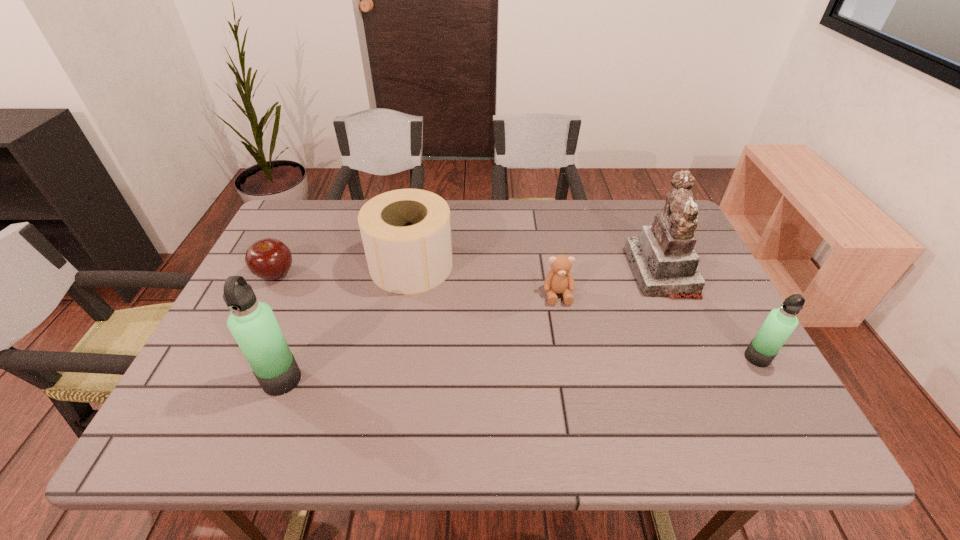
Where is `vacant space in between the fourth object from left to right and the right thermos bottle`? This screenshot has width=960, height=540. vacant space in between the fourth object from left to right and the right thermos bottle is located at coordinates (658, 326).

Find the location of a particular element. Image resolution: width=960 pixels, height=540 pixels. free space between the figurine and the fifth object from right to left is located at coordinates (471, 326).

The width and height of the screenshot is (960, 540). I want to click on free area in between the left thermos bottle and the teddy bear, so click(420, 337).

Where is `vacant area between the teddy bear and the second object from right to left`? Image resolution: width=960 pixels, height=540 pixels. vacant area between the teddy bear and the second object from right to left is located at coordinates (610, 283).

At what (x,y) coordinates should I click in order to perform the action: click on vacant space in between the second object from right to left and the apple. Please return your answer as a coordinate pair (x, y). Image resolution: width=960 pixels, height=540 pixels. Looking at the image, I should click on (468, 273).

The height and width of the screenshot is (540, 960). Identify the location of vacant area between the left thermos bottle and the fourth object from right to left. (347, 322).

Find the location of `blank region between the fifth object from right to left and the rightmost object`. blank region between the fifth object from right to left and the rightmost object is located at coordinates (519, 368).

The width and height of the screenshot is (960, 540). Identify the location of object that ranks as the second closest to the shorter thermos bottle. (559, 280).

Select which object is the closest to the fourth object from left to right. Please provide its 2D coordinates. Your answer should be formatted as a tuple, i.e. [(x, y)], where the tuple contains the x and y coordinates of a point satisfying the conditions above.

[(663, 259)]

At what (x,y) coordinates should I click in order to perform the action: click on vacant region that satisfies the following two spatial constraints: 1. on the face of the fourth object from left to right; 2. on the left side of the rightmost object. Please return your answer as a coordinate pair (x, y). Image resolution: width=960 pixels, height=540 pixels. Looking at the image, I should click on (569, 357).